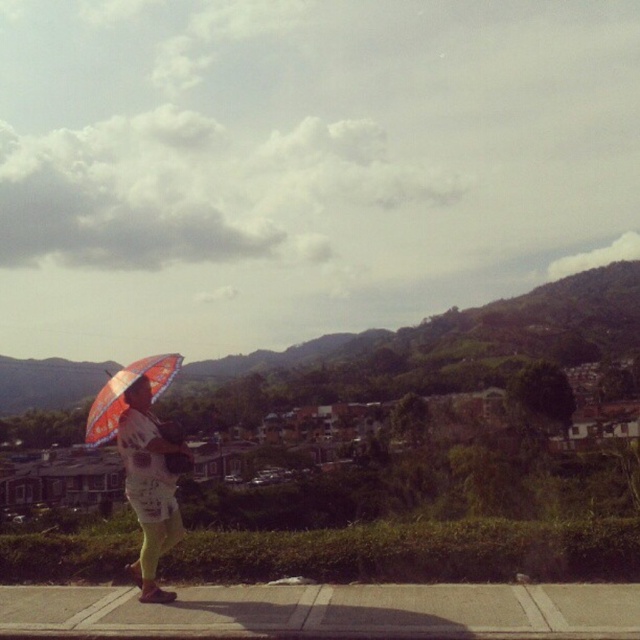
Question: Among these objects, which one is nearest to the camera?

Choices:
 (A) green grassy hillside at upper center
 (B) matte orange umbrella at left
 (C) orange fabric umbrella at left

Answer: (B)

Question: Can you confirm if green grassy hillside at upper center is positioned above orange fabric umbrella at left?

Choices:
 (A) no
 (B) yes

Answer: (A)

Question: Does green grassy hillside at upper center lie behind orange fabric umbrella at left?

Choices:
 (A) yes
 (B) no

Answer: (A)

Question: In this image, where is matte orange umbrella at left located relative to orange fabric umbrella at left?

Choices:
 (A) below
 (B) above

Answer: (A)

Question: Among these points, which one is farthest from the camera?

Choices:
 (A) (634, 266)
 (B) (113, 380)

Answer: (A)

Question: Which object is positioned farthest from the green grassy hillside at upper center?

Choices:
 (A) matte orange umbrella at left
 (B) orange fabric umbrella at left

Answer: (B)